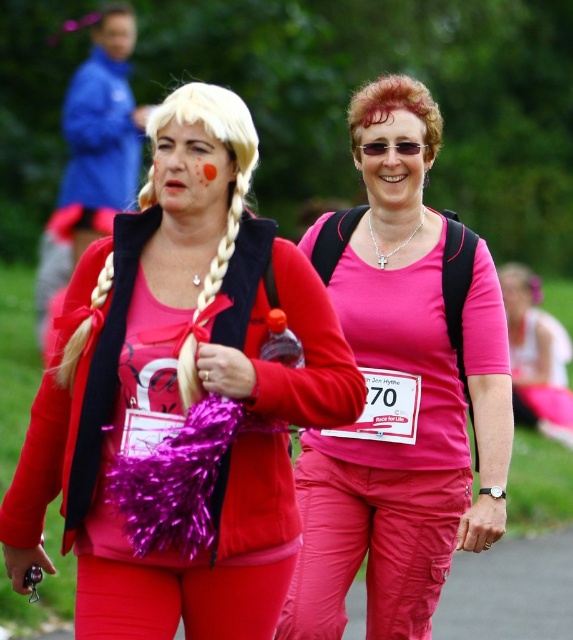
Between matte pink wig at center and smooth skin face at upper left, which one appears on the right side from the viewer's perspective?

Positioned to the right is matte pink wig at center.

Is point (176, 593) positioned in front of point (132, 20)?

Yes, it is in front of point (132, 20).

Between point (174, 346) and point (109, 24), which one is positioned in front?

Point (174, 346) is in front.

This screenshot has width=573, height=640. Find the location of `matte pink wig at center`. matte pink wig at center is located at coordinates (179, 410).

You are a GUI agent. You are given a task and a screenshot of the screen. Output one action in this format:
    pyautogui.click(x=<x>, y=<y>)
    Task: Click on the smooth skin face at upper left
    This screenshot has width=573, height=640.
    Given the screenshot: What is the action you would take?
    pyautogui.click(x=115, y=35)

From the picture: Does smooth skin face at upper left appear on the left side of sunglasses at center?

Correct, you'll find smooth skin face at upper left to the left of sunglasses at center.

Who is more distant from viewer, (108,35) or (382,145)?

Point (108,35)

Where is `smooth skin face at upper left`? smooth skin face at upper left is located at coordinates [x=115, y=35].

Between pink matte shirt at center and sunglasses at center, which one has less height?

With less height is sunglasses at center.

Is pink matte shirt at center below sunglasses at center?

Correct, pink matte shirt at center is located below sunglasses at center.

What do you see at coordinates (402, 435) in the screenshot?
I see `pink matte shirt at center` at bounding box center [402, 435].

This screenshot has height=640, width=573. What are the coordinates of `pink matte shirt at center` in the screenshot? It's located at (402, 435).